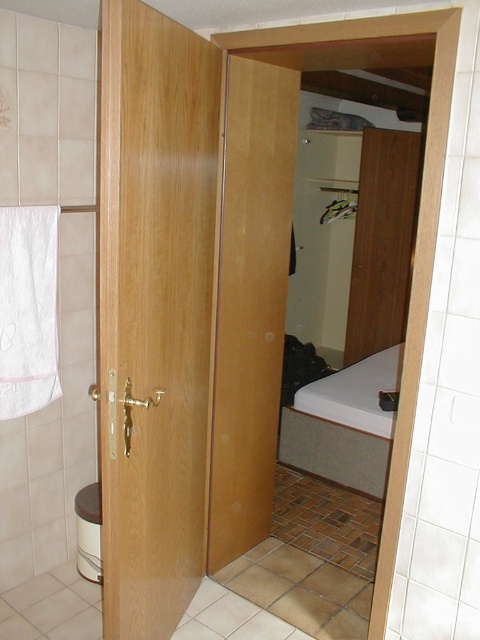
Question: Which object appears farthest from the camera in this image?

Choices:
 (A) wooden door at center
 (B) white glossy toilet bowl at lower left
 (C) light brown wood door at center

Answer: (B)

Question: Is wooden door at center smaller than white glossy toilet bowl at lower left?

Choices:
 (A) no
 (B) yes

Answer: (A)

Question: Is wooden door at center bigger than white glossy toilet bowl at lower left?

Choices:
 (A) yes
 (B) no

Answer: (A)

Question: Is wooden door at center smaller than white glossy toilet bowl at lower left?

Choices:
 (A) no
 (B) yes

Answer: (A)

Question: Which point is closer to the camera?

Choices:
 (A) (79, 504)
 (B) (154, 19)

Answer: (B)

Question: Which of the following is the farthest from the observer?

Choices:
 (A) white glossy toilet bowl at lower left
 (B) wooden door at center

Answer: (A)